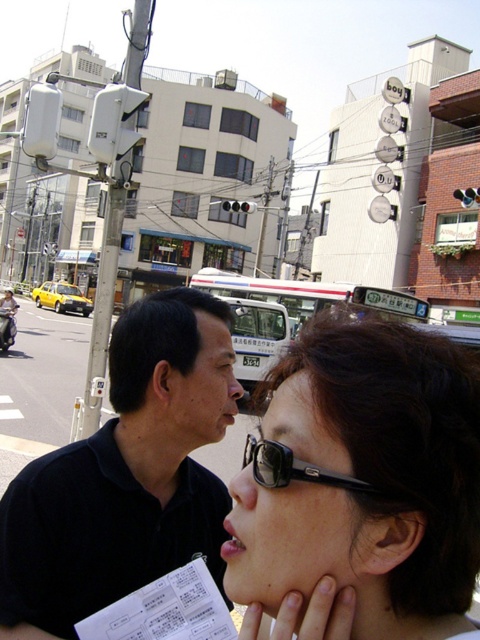
Question: Among these objects, which one is farthest from the camera?

Choices:
 (A) black matte shirt at center
 (B) black matte sunglasses at center

Answer: (A)

Question: Does black matte sunglasses at center appear on the right side of black matte shirt at center?

Choices:
 (A) yes
 (B) no

Answer: (A)

Question: Which of the following is the closest to the observer?

Choices:
 (A) (423, 497)
 (B) (97, 589)
 (C) (269, 451)

Answer: (A)

Question: Can you confirm if black matte shirt at center is positioned to the left of black plastic sunglasses at upper center?

Choices:
 (A) no
 (B) yes

Answer: (B)

Question: Is black matte sunglasses at center above black plastic sunglasses at upper center?

Choices:
 (A) no
 (B) yes

Answer: (A)

Question: Which object is farther from the camera taking this photo?

Choices:
 (A) black matte shirt at center
 (B) black matte sunglasses at center
 (C) black plastic sunglasses at upper center

Answer: (A)